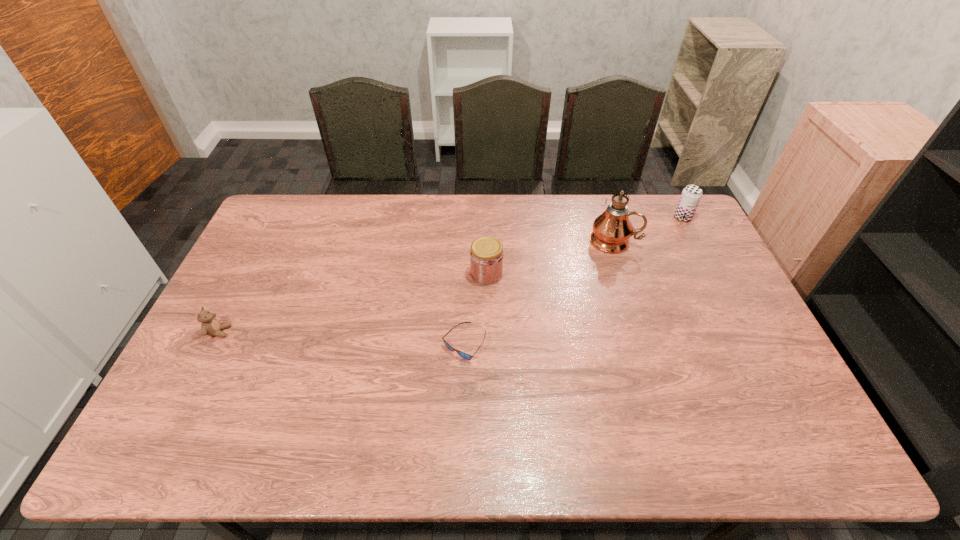
In the image, there is a desktop. At what (x,y) coordinates should I click in order to perform the action: click on vacant space at the left edge. Please return your answer as a coordinate pair (x, y). This screenshot has height=540, width=960. Looking at the image, I should click on (300, 237).

This screenshot has height=540, width=960. What are the coordinates of `vacant space at the right edge of the desktop` in the screenshot? It's located at tap(744, 379).

In the image, there is a desktop. Identify the location of free space at the far left corner. (281, 210).

Where is `blank region between the sunglasses and the rightmost object`? blank region between the sunglasses and the rightmost object is located at coordinates (573, 280).

At what (x,y) coordinates should I click in order to perform the action: click on free area in between the farthest object and the third nearest object. Please return your answer as a coordinate pair (x, y). Looking at the image, I should click on (585, 245).

This screenshot has width=960, height=540. Identify the location of free space between the shortest object and the oil lamp. (540, 292).

Where is `free area in between the leftmost object and the third nearest object`? This screenshot has width=960, height=540. free area in between the leftmost object and the third nearest object is located at coordinates (352, 302).

At what (x,y) coordinates should I click in order to perform the action: click on unoccupied area between the rightmost object and the leftmost object. Please return your answer as a coordinate pair (x, y). This screenshot has height=540, width=960. Looking at the image, I should click on (451, 274).

Locate an element on the screen. This screenshot has width=960, height=540. free area in between the fourth tallest object and the third farthest object is located at coordinates (352, 302).

Identify the location of free space between the jam and the beer can. Image resolution: width=960 pixels, height=540 pixels. (585, 245).